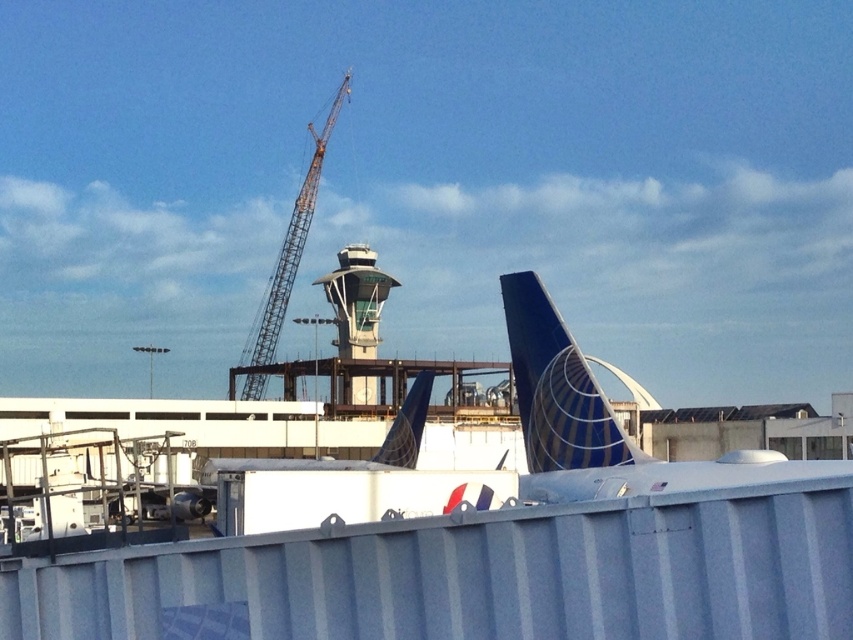
Is green glass control tower at center further to camera compared to metallic gray crane at center?

No, green glass control tower at center is closer to the viewer.

Does green glass control tower at center have a greater width compared to metallic gray crane at center?

No, green glass control tower at center is not wider than metallic gray crane at center.

What are the coordinates of `green glass control tower at center` in the screenshot? It's located at (357, 300).

Which is above, blue glossy tail fin at center or green glass control tower at center?

green glass control tower at center is higher up.

The width and height of the screenshot is (853, 640). What do you see at coordinates (556, 387) in the screenshot?
I see `blue glossy tail fin at center` at bounding box center [556, 387].

Image resolution: width=853 pixels, height=640 pixels. What do you see at coordinates (556, 387) in the screenshot?
I see `blue glossy tail fin at center` at bounding box center [556, 387].

You are a GUI agent. You are given a task and a screenshot of the screen. Output one action in this format:
    pyautogui.click(x=<x>, y=<y>)
    Task: Click on the blue glossy tail fin at center
    The height and width of the screenshot is (640, 853).
    Given the screenshot: What is the action you would take?
    pyautogui.click(x=556, y=387)

Is blue glossy tail fin at center bigger than blue painted tail fin at center?

Yes.

Which is in front, point (572, 387) or point (398, 445)?

Point (572, 387) is in front.

This screenshot has height=640, width=853. What are the coordinates of `blue glossy tail fin at center` in the screenshot? It's located at (556, 387).